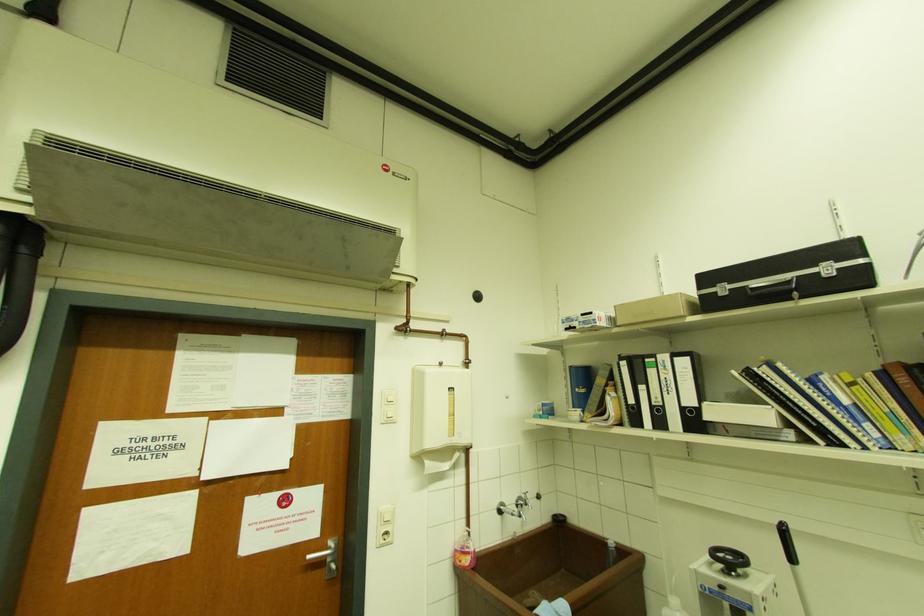
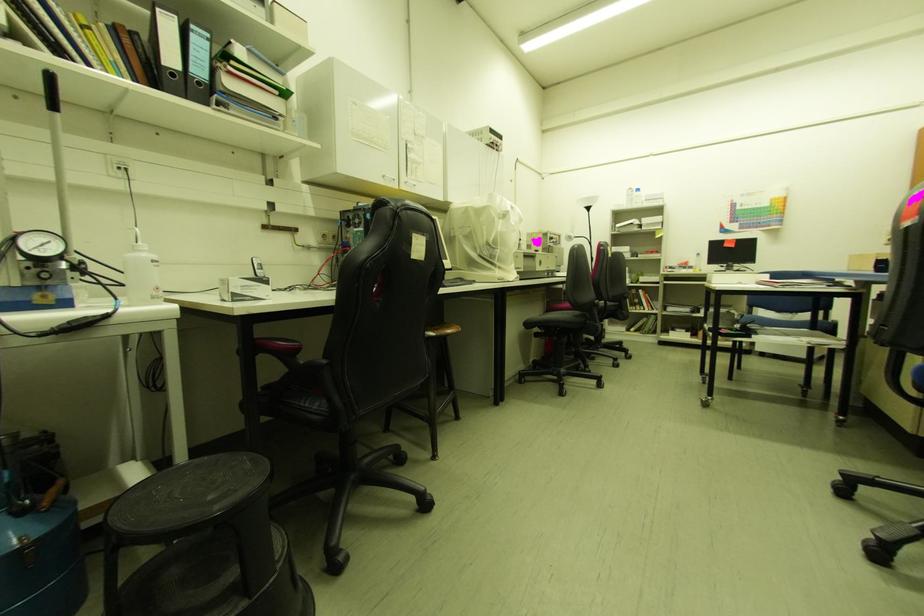
Question: The camera is either moving clockwise (left) or counter-clockwise (right) around the object. The first image is from the beginning of the video and the second image is from the end. Is the camera moving left or right when shooting the video?

Choices:
 (A) Left
 (B) Right

Answer: (A)